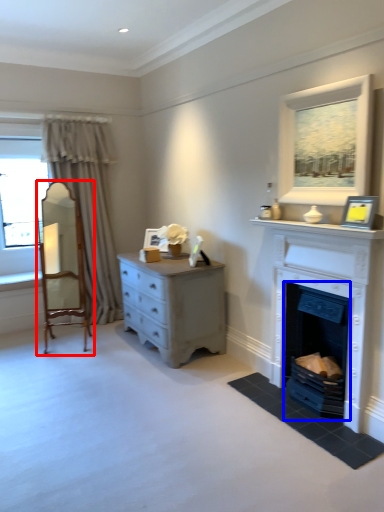
Question: Which object is closer to the camera taking this photo, armchair (highlighted by a red box) or fireplace (highlighted by a blue box)?

Choices:
 (A) armchair
 (B) fireplace

Answer: (B)